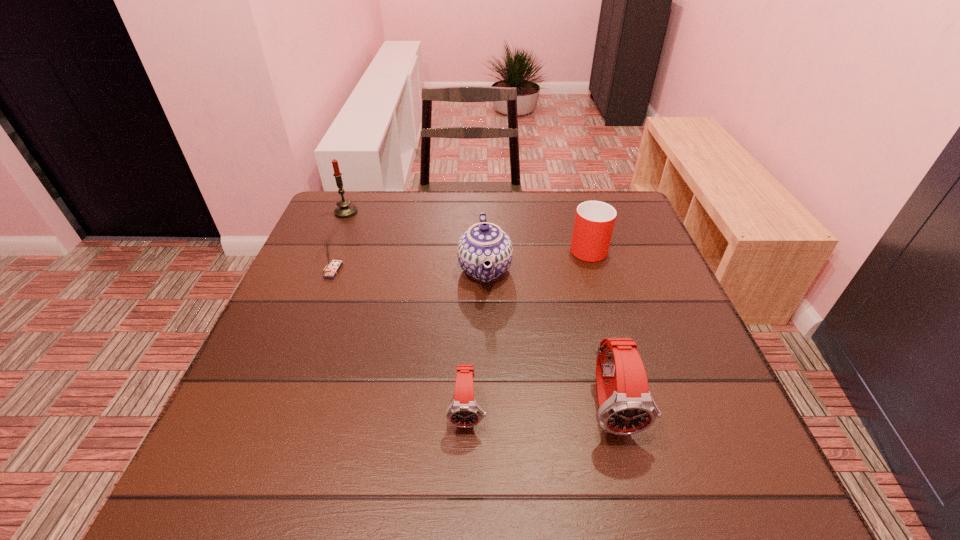
What are the coordinates of `free point between the farthest object and the matchbox` in the screenshot? It's located at (339, 241).

The width and height of the screenshot is (960, 540). In order to click on free space between the left watch and the cup in this screenshot , I will do `click(527, 328)`.

The width and height of the screenshot is (960, 540). I want to click on free space between the right watch and the shorter watch, so click(x=540, y=408).

Where is `empty location between the chinaware and the farthest object`? empty location between the chinaware and the farthest object is located at coordinates (416, 241).

The image size is (960, 540). Identify the location of free space between the matchbox and the shorter watch. (x=399, y=340).

Identify the location of free point between the matchbox and the taller watch. Image resolution: width=960 pixels, height=540 pixels. (472, 339).

Identify the location of the fourth closest object to the candle. (464, 412).

Identify the location of object that is the fifth closest to the cup. (345, 209).

Locate an element on the screen. free spot that satisfies the following two spatial constraints: 1. at the spout of the chinaware; 2. on the face of the left watch is located at coordinates (487, 409).